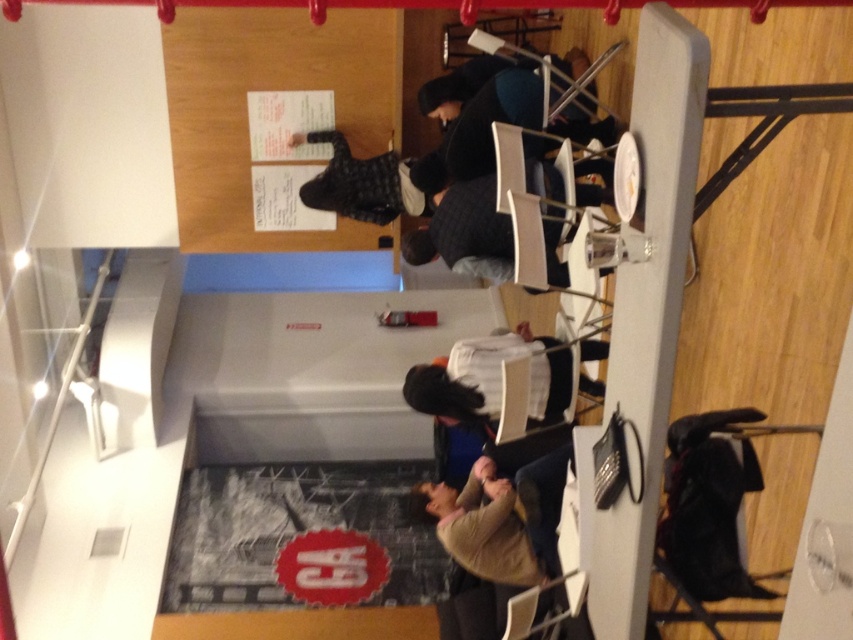
Question: Does light brown sweater at lower center come behind dark blue sweater at upper center?

Choices:
 (A) yes
 (B) no

Answer: (B)

Question: Estimate the real-world distances between objects in this image. Which object is closer to the checkered fabric jacket at center?

Choices:
 (A) white fabric shirt at center
 (B) dark blue sweater at upper center

Answer: (B)

Question: Is light brown sweater at lower center thinner than checkered fabric jacket at center?

Choices:
 (A) yes
 (B) no

Answer: (A)

Question: Considering the real-world distances, which object is farthest from the checkered fabric jacket at center?

Choices:
 (A) white fabric shirt at center
 (B) dark blue sweater at upper center
 (C) light brown sweater at lower center

Answer: (C)

Question: Which object appears closest to the camera in this image?

Choices:
 (A) checkered fabric jacket at center
 (B) light brown sweater at lower center
 (C) white fabric shirt at center
 (D) dark blue sweater at upper center

Answer: (C)

Question: Can you confirm if checkered fabric jacket at center is smaller than dark blue sweater at upper center?

Choices:
 (A) no
 (B) yes

Answer: (B)